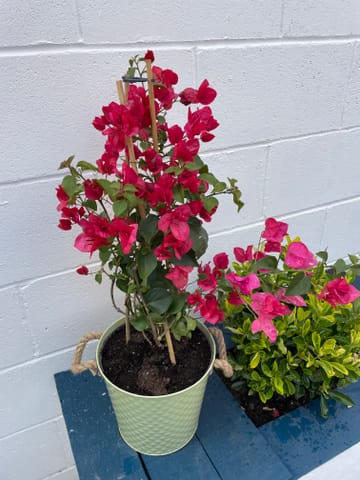
Find the location of a particular element. white metal textured pot is located at coordinates (145, 408).